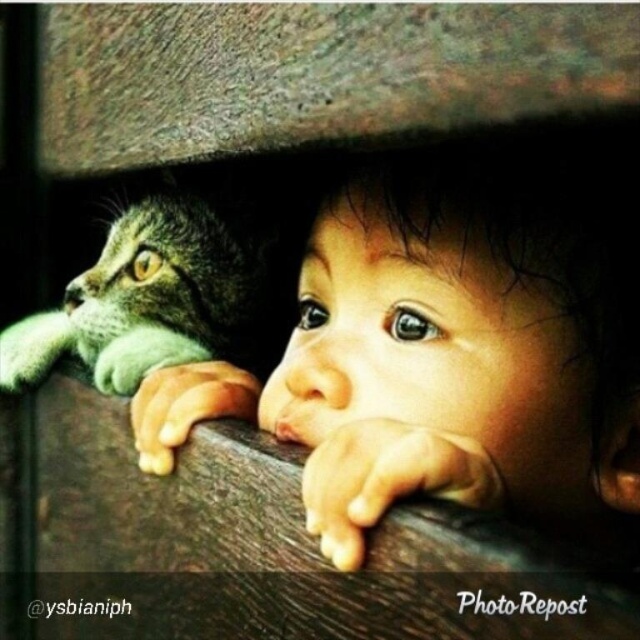
You are a photographer trying to capture a closeup shot of the smooth skin baby at center and the tabby fur cat at left. Given that your camera can focus on subjects within a 10 inch range, will you be able to get both in focus?

The smooth skin baby at center is 10.34 inches from the tabby fur cat at left, which is slightly beyond the camera focus range of 10 inches. Therefore, you cannot get both in focus.